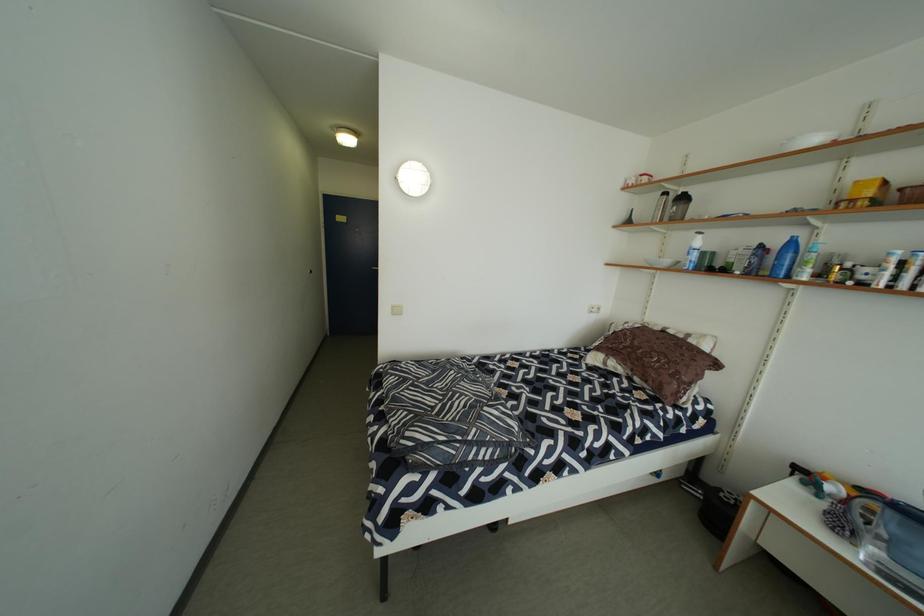
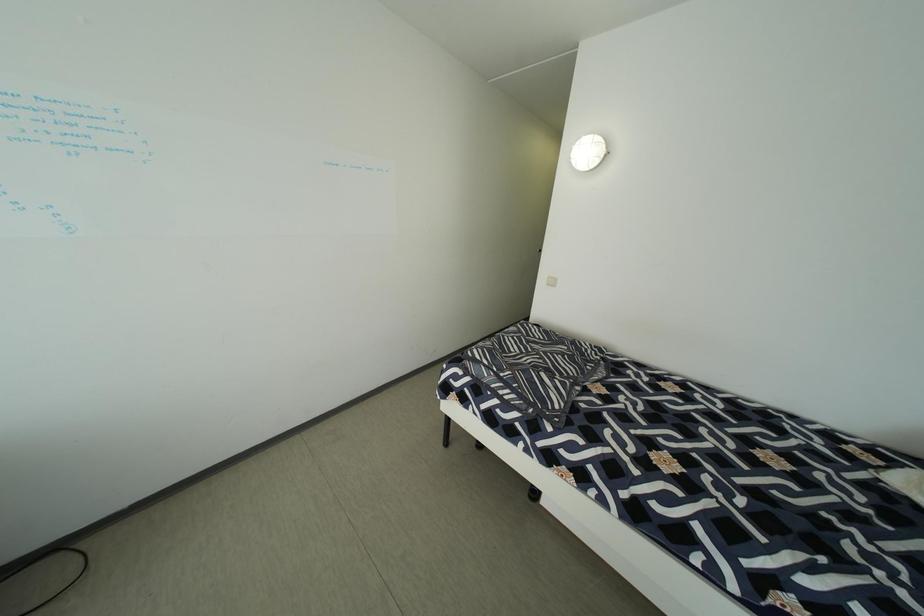
Question: The camera is either moving clockwise (left) or counter-clockwise (right) around the object. The first image is from the beginning of the video and the second image is from the end. Is the camera moving left or right when shooting the video?

Choices:
 (A) Left
 (B) Right

Answer: (B)